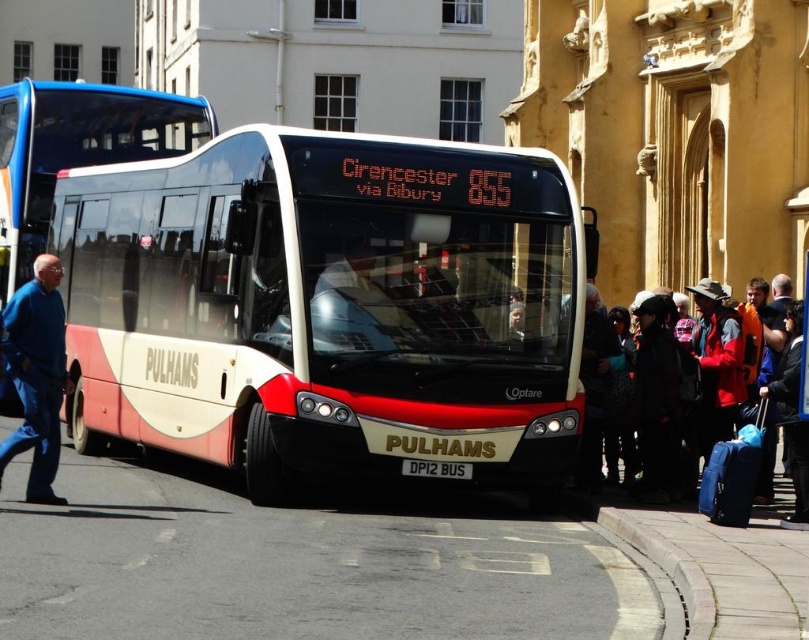
Question: From the image, what is the correct spatial relationship of matte white bus at center in relation to blue fabric suitcase at right?

Choices:
 (A) below
 (B) above

Answer: (B)

Question: Can you confirm if blue jeans at left is smaller than white concrete curb at lower right?

Choices:
 (A) no
 (B) yes

Answer: (A)

Question: Can you confirm if matte white bus at center is smaller than white plastic license plate at center?

Choices:
 (A) yes
 (B) no

Answer: (B)

Question: Which object is farther from the camera taking this photo?

Choices:
 (A) matte white and red bus at center
 (B) white concrete curb at lower right

Answer: (A)

Question: Which of the following is the farthest from the observer?

Choices:
 (A) (712, 618)
 (B) (807, 428)
 (C) (420, 472)

Answer: (C)

Question: Among these points, which one is nearest to the camera?

Choices:
 (A) (798, 515)
 (B) (6, 260)

Answer: (A)